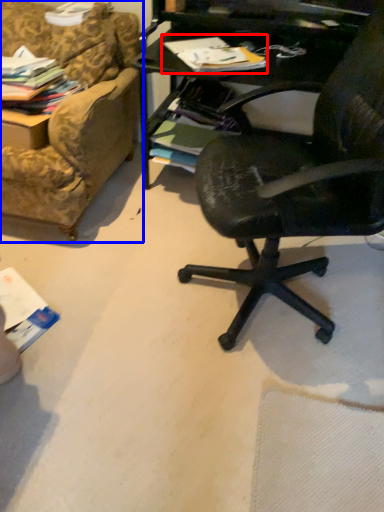
Question: Which object is further to the camera taking this photo, magazine (highlighted by a red box) or studio couch (highlighted by a blue box)?

Choices:
 (A) magazine
 (B) studio couch

Answer: (B)